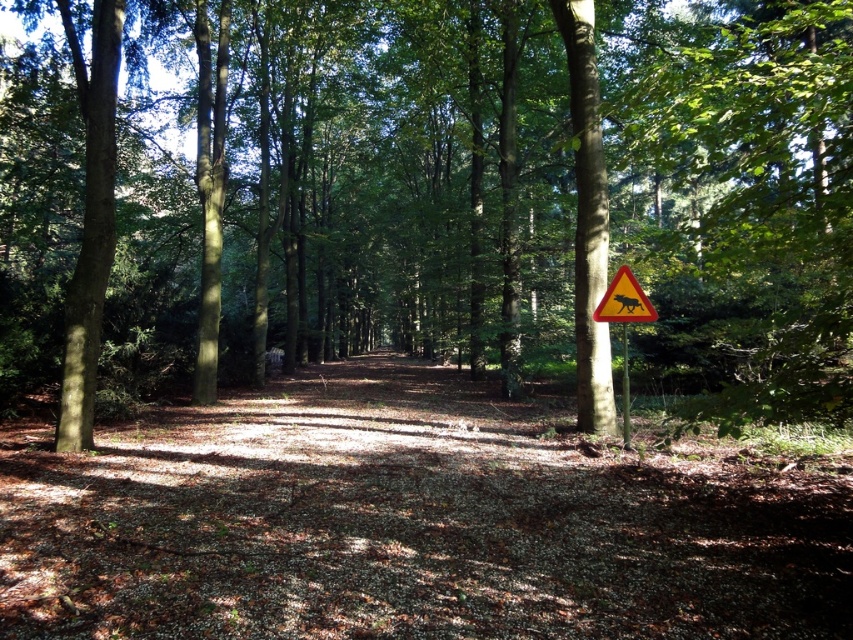
Question: Can you confirm if green leafy tree at center is positioned to the left of yellow reflective triangle at upper right?

Choices:
 (A) yes
 (B) no

Answer: (A)

Question: Which object is closer to the camera taking this photo?

Choices:
 (A) yellow reflective triangle at upper right
 (B) yellow plastic sign at center-right

Answer: (A)

Question: Considering the relative positions of yellow reflective triangle at center-right and yellow plastic sign at center-right in the image provided, where is yellow reflective triangle at center-right located with respect to yellow plastic sign at center-right?

Choices:
 (A) below
 (B) above

Answer: (B)

Question: Which object is farther from the camera taking this photo?

Choices:
 (A) green leafy tree at center
 (B) yellow reflective triangle at upper right

Answer: (B)

Question: Which object is closer to the camera taking this photo?

Choices:
 (A) yellow reflective triangle at center-right
 (B) yellow plastic sign at center-right
 (C) yellow reflective triangle at upper right
 (D) green leafy tree at center

Answer: (D)

Question: Is yellow reflective triangle at upper right below yellow plastic sign at center-right?

Choices:
 (A) yes
 (B) no

Answer: (B)